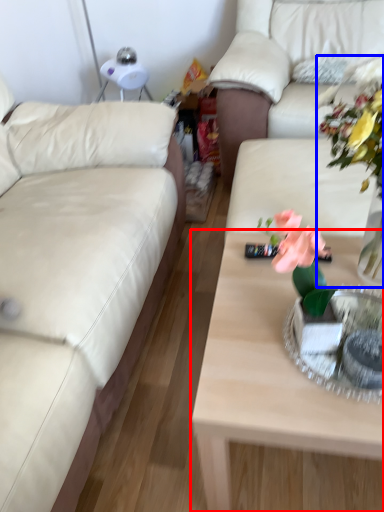
Question: Which object is closer to the camera taking this photo, coffee table (highlighted by a red box) or floral arrangement (highlighted by a blue box)?

Choices:
 (A) coffee table
 (B) floral arrangement

Answer: (B)